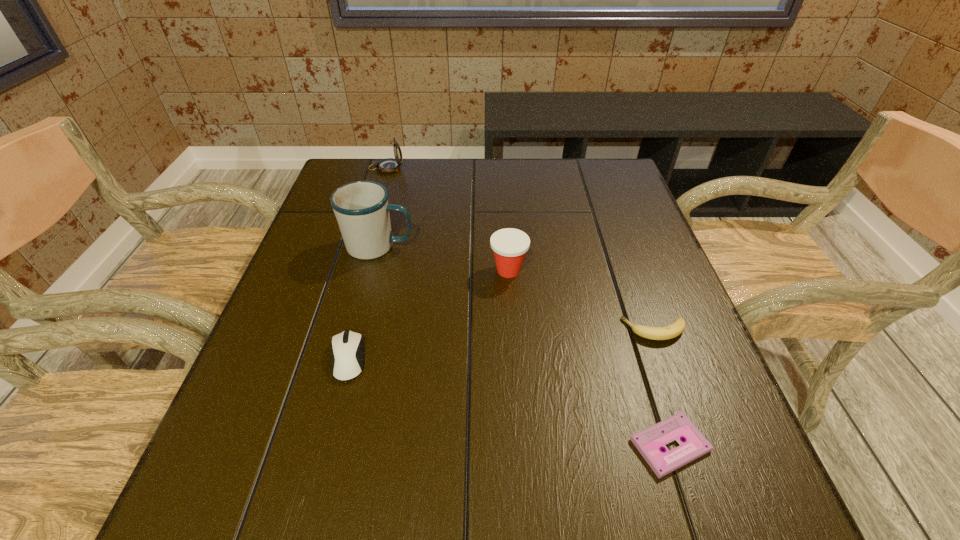
Where is `free point that satisfies the following two spatial constraints: 1. on the handle side of the shortest object; 2. on the right side of the tallest object`? This screenshot has width=960, height=540. free point that satisfies the following two spatial constraints: 1. on the handle side of the shortest object; 2. on the right side of the tallest object is located at coordinates (329, 445).

Find the location of a particular element. Image resolution: width=960 pixels, height=540 pixels. vacant space that satisfies the following two spatial constraints: 1. on the back side of the shortest object; 2. on the handle side of the tallest object is located at coordinates (607, 246).

Identify the location of blank space that satisfies the following two spatial constraints: 1. on the handle side of the fourth object from left to right; 2. on the right side of the mug. This screenshot has height=540, width=960. (373, 271).

The height and width of the screenshot is (540, 960). In order to click on vacant space that satisfies the following two spatial constraints: 1. at the stem of the second shortest object; 2. on the front side of the nearest object in this screenshot , I will do `click(696, 445)`.